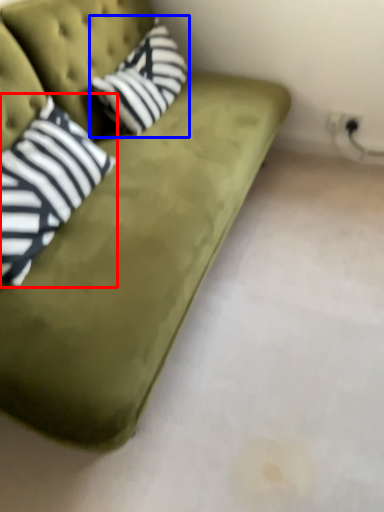
Question: Among these objects, which one is farthest to the camera, pillow (highlighted by a red box) or throw pillow (highlighted by a blue box)?

Choices:
 (A) pillow
 (B) throw pillow

Answer: (B)